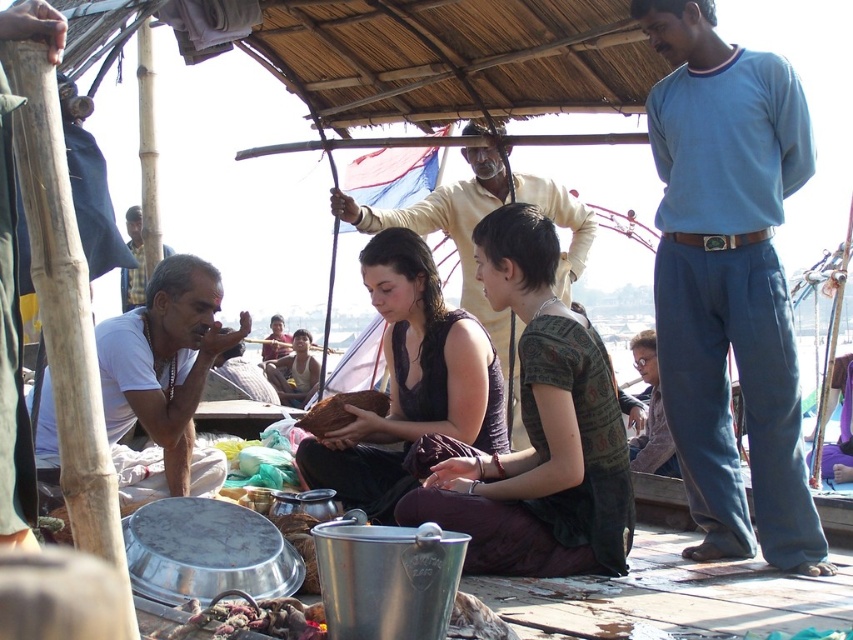
Who is more forward, (x=502, y=465) or (x=488, y=344)?

Point (x=502, y=465)

Which is in front, point (531, 449) or point (389, 332)?

Positioned in front is point (531, 449).

This screenshot has height=640, width=853. I want to click on dark purple fabric at center, so click(x=538, y=429).

Can you confirm if light yellow shirt at center is positioned above brown leather bag at center?

Yes.

Is point (520, 198) behind point (260, 358)?

No, (520, 198) is in front of (260, 358).

Find the location of a particular element. The image size is (853, 640). light yellow shirt at center is located at coordinates (456, 240).

Is point (155, 332) positioned after point (276, 353)?

No, it is not.

Consider the image. Is white matte shirt at left smaller than brown leather bag at center?

Incorrect, white matte shirt at left is not smaller in size than brown leather bag at center.

You are a GUI agent. You are given a task and a screenshot of the screen. Output one action in this format:
    pyautogui.click(x=<x>, y=<y>)
    Task: Click on the white matte shirt at left
    The height and width of the screenshot is (640, 853).
    Given the screenshot: What is the action you would take?
    pyautogui.click(x=164, y=380)